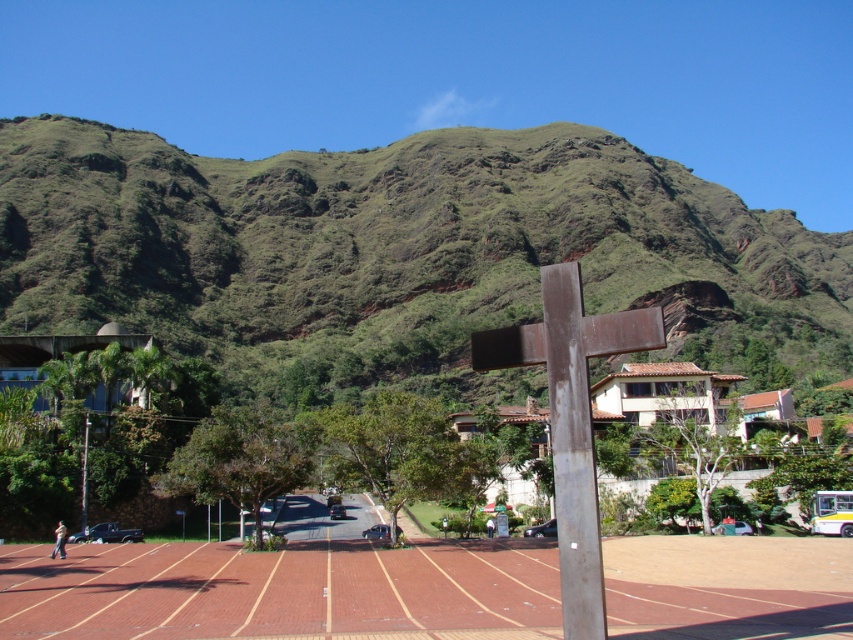
Between green grassy hill at upper center and rusty metal cross at center, which one is positioned lower?

Positioned lower is rusty metal cross at center.

Does point (755, 256) come closer to viewer compared to point (560, 292)?

No, it is behind (560, 292).

Identify the location of green grassy hill at upper center. (399, 253).

Between brick textured race track at center and rusty metal cross at center, which one is positioned higher?

Positioned higher is rusty metal cross at center.

Does brick textured race track at center appear under rusty metal cross at center?

Yes, brick textured race track at center is below rusty metal cross at center.

Who is more forward, (672, 602) or (537, 328)?

Point (537, 328)

You are a GUI agent. You are given a task and a screenshot of the screen. Output one action in this format:
    pyautogui.click(x=<x>, y=<y>)
    Task: Click on the brick textured race track at center
    The height and width of the screenshot is (640, 853).
    Given the screenshot: What is the action you would take?
    pyautogui.click(x=285, y=586)

Is green grassy hill at upper center above brick textured race track at center?

Yes, green grassy hill at upper center is above brick textured race track at center.

Who is taller, green grassy hill at upper center or brick textured race track at center?

Standing taller between the two is green grassy hill at upper center.

From the picture: Who is more forward, (x=459, y=184) or (x=457, y=579)?

Positioned in front is point (x=457, y=579).

At what (x,y) coordinates should I click in order to perform the action: click on green grassy hill at upper center. Please return your answer as a coordinate pair (x, y). Looking at the image, I should click on (399, 253).